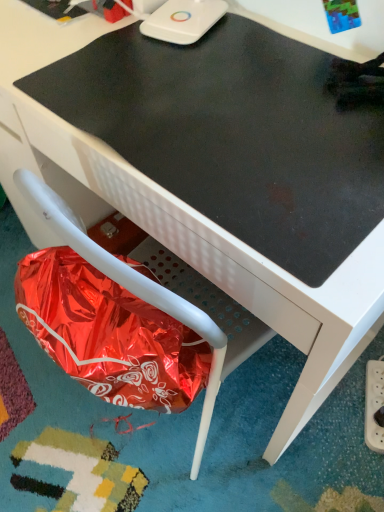
Image resolution: width=384 pixels, height=512 pixels. Describe the element at coordinates (129, 286) in the screenshot. I see `metallic red bean bag chair at lower left` at that location.

Measure the distance between point (200, 426) and camera.

Point (200, 426) and camera are 32.09 inches apart.

In order to click on metallic red bean bag chair at lower left in this screenshot , I will do [x=129, y=286].

Find the location of a particular element. This screenshot has width=384, height=512. metallic red bean bag chair at lower left is located at coordinates (129, 286).